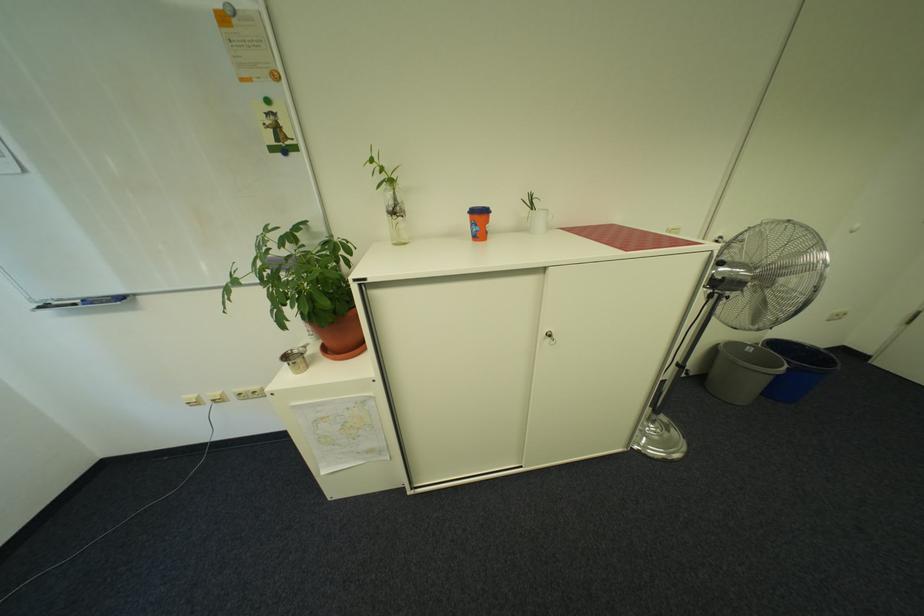
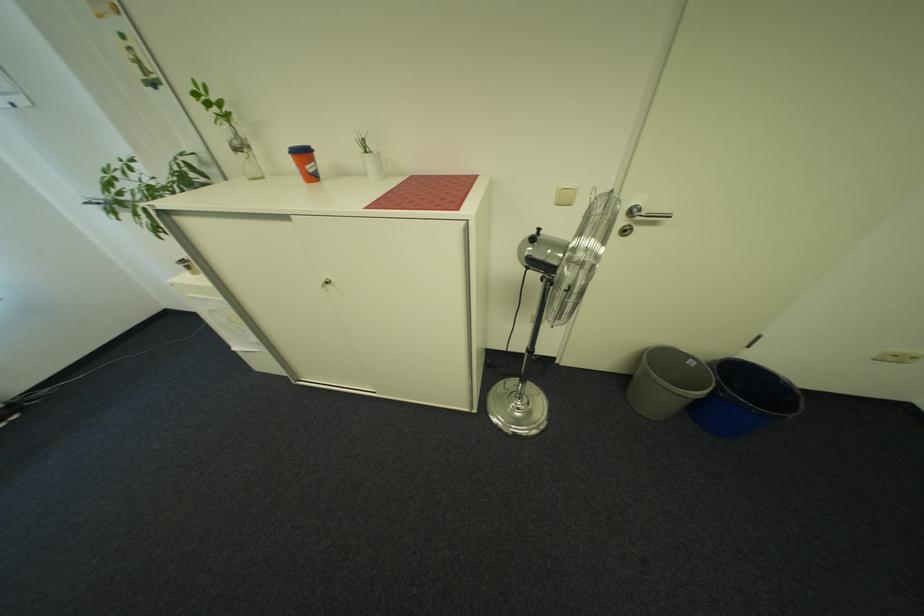
Locate, in the second image, the point that corresponds to point (759, 350) in the first image.

(700, 363)